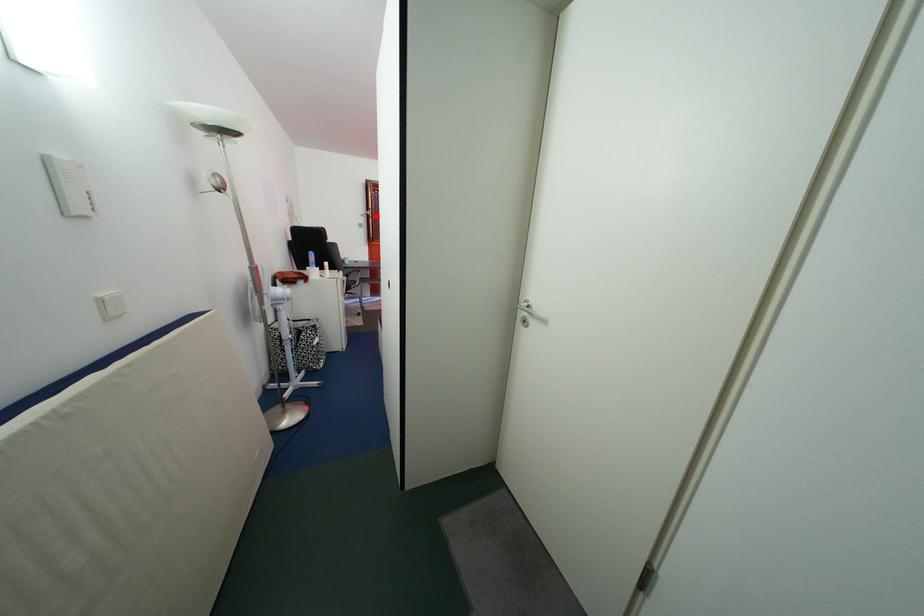
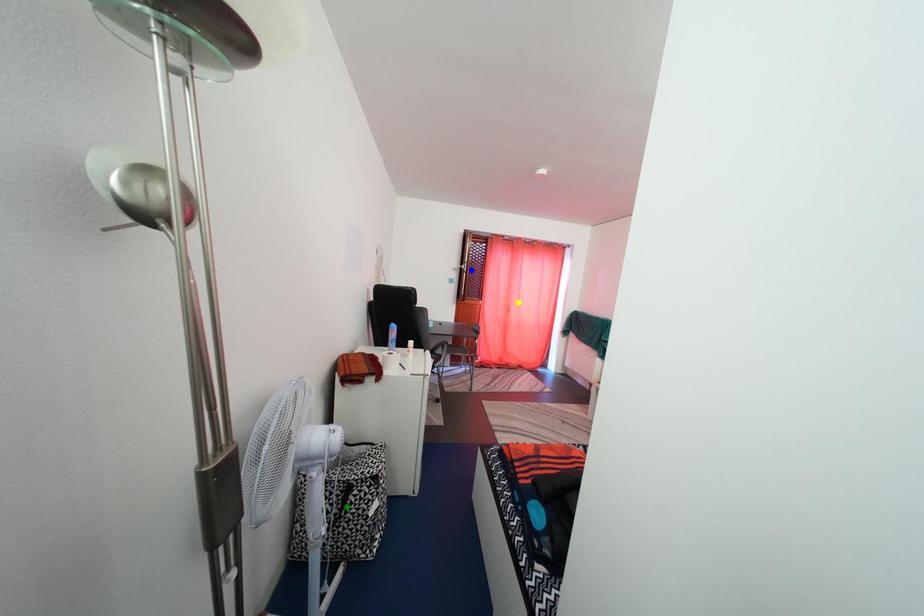
Question: I am providing you with two images of the same scene from different viewpoints. A red point is marked on the first image. You are given multiple points on the second image. Which mark in image 2 goes with the point in image 1?

Choices:
 (A) blue point
 (B) green point
 (C) yellow point

Answer: (A)